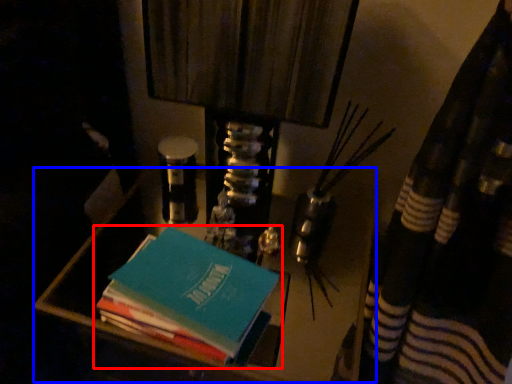
Question: Which point is closer to the camera, book (highlighted by a red box) or vanity (highlighted by a blue box)?

Choices:
 (A) book
 (B) vanity

Answer: (A)